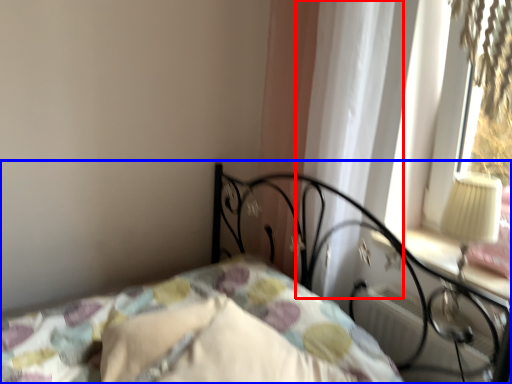
Question: Which object appears farthest to the camera in this image, curtain (highlighted by a red box) or bed (highlighted by a blue box)?

Choices:
 (A) curtain
 (B) bed

Answer: (A)